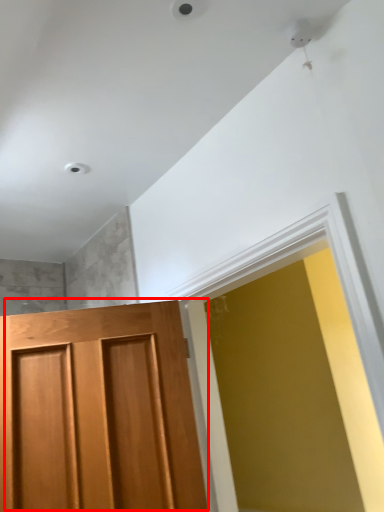
Question: From the image's perspective, where is door (annotated by the red box) located relative to window?

Choices:
 (A) above
 (B) below

Answer: (B)